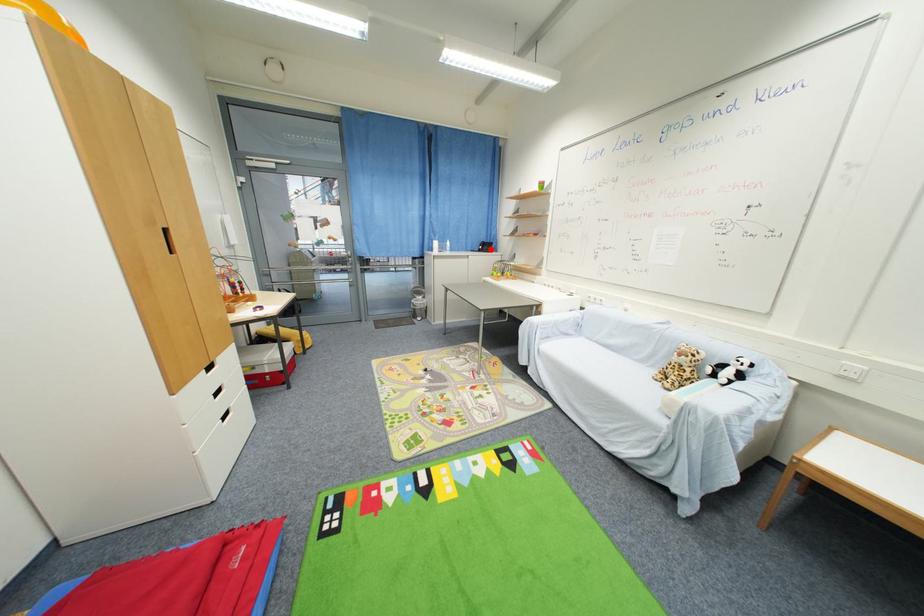
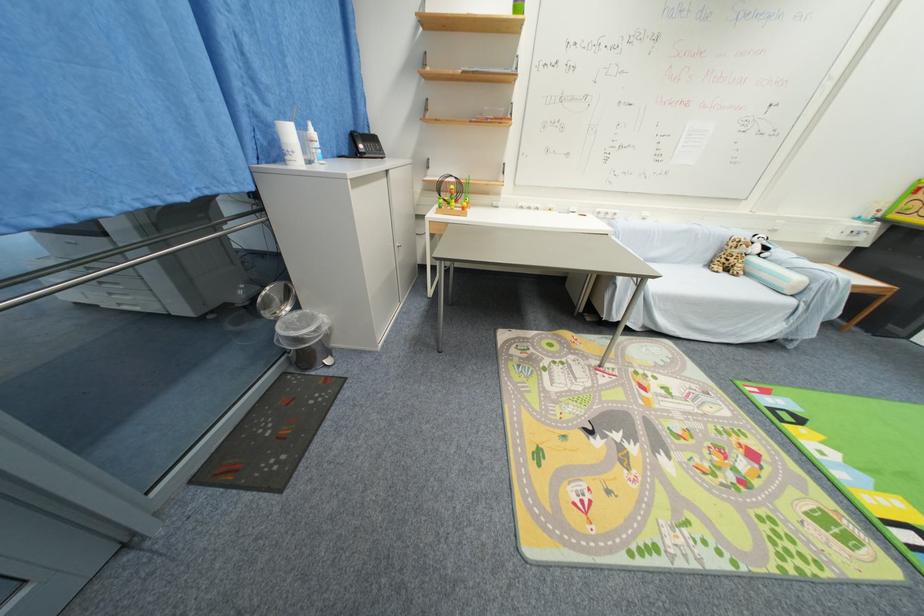
Where in the second image is the point corresponding to the highlighted location from the first image?

(377, 148)